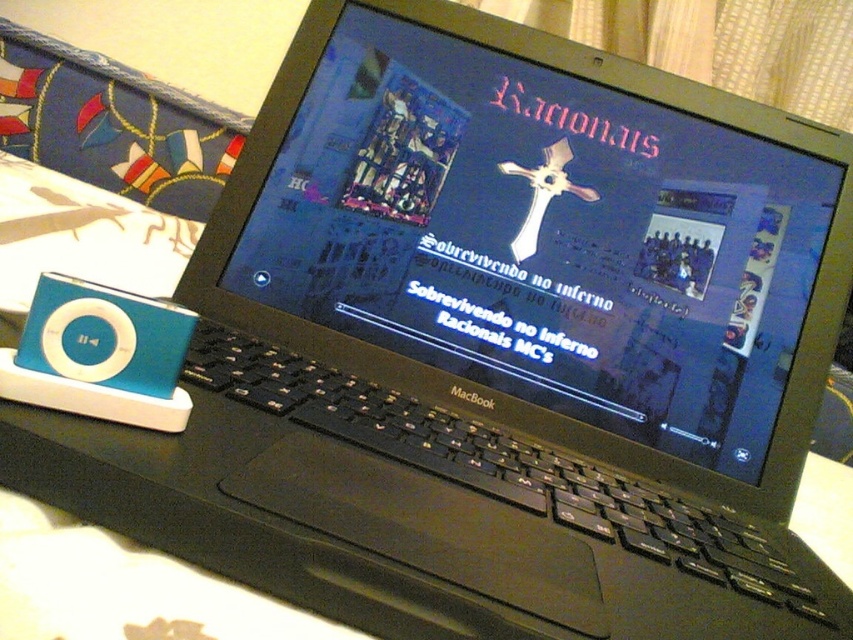
Question: Is the position of black matte laptop at center less distant than that of teal matte ipod at left?

Choices:
 (A) no
 (B) yes

Answer: (A)

Question: Which point appears closest to the camera in this image?

Choices:
 (A) (53, 355)
 (B) (405, 314)

Answer: (A)

Question: Can you confirm if black matte laptop at center is thinner than teal matte ipod at left?

Choices:
 (A) no
 (B) yes

Answer: (A)

Question: Can you confirm if black matte laptop at center is bigger than teal matte ipod at left?

Choices:
 (A) no
 (B) yes

Answer: (B)

Question: Which of the following is the closest to the observer?

Choices:
 (A) (374, 4)
 (B) (35, 317)

Answer: (B)